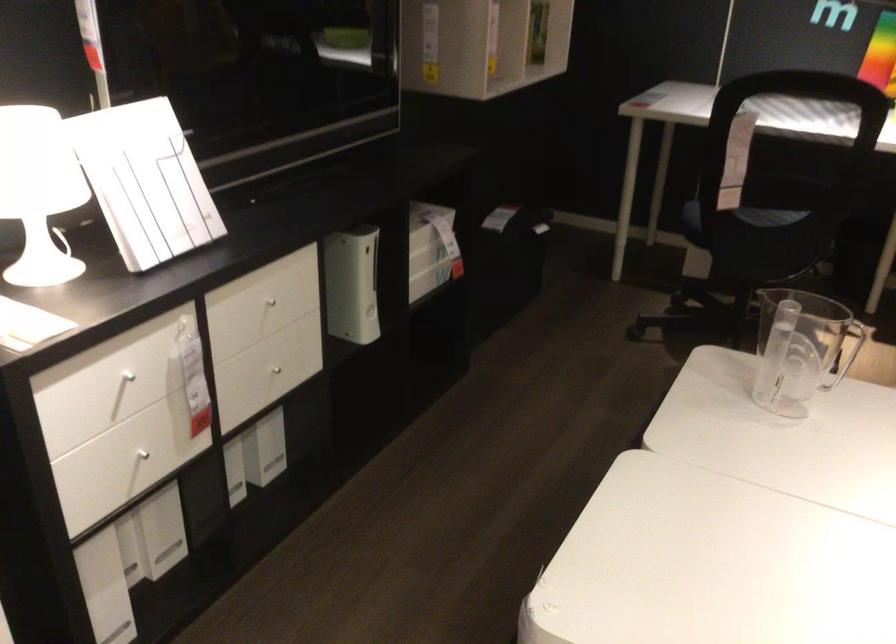
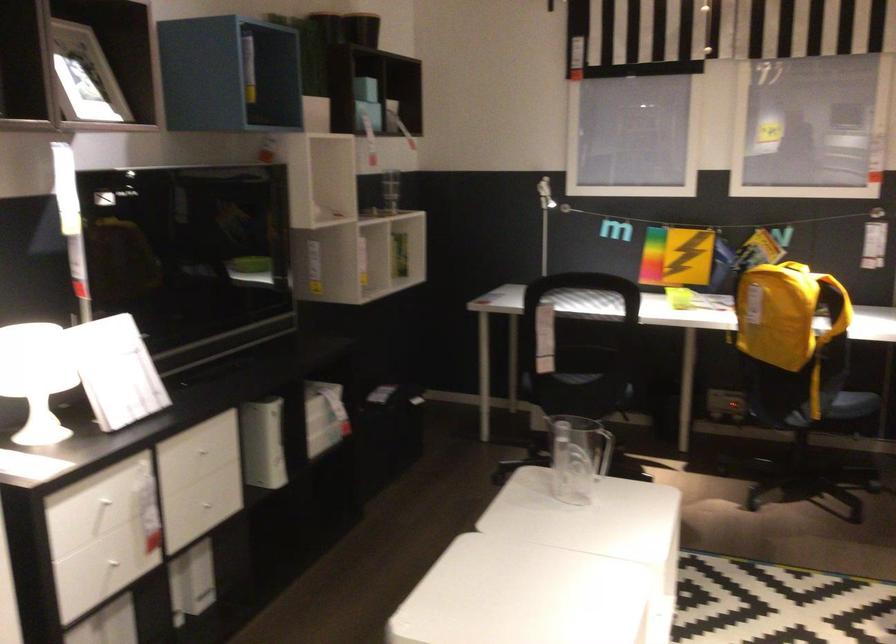
The point at (136, 458) is marked in the first image. Where is the corresponding point in the second image?

(110, 567)